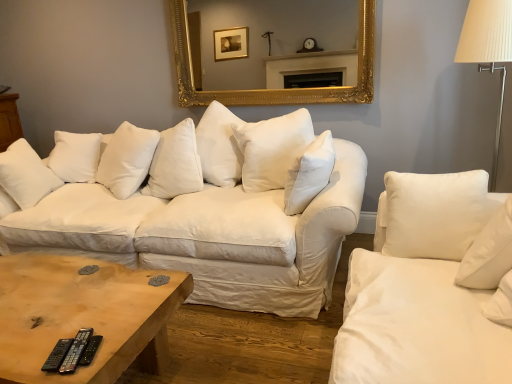
Question: Considering the relative positions of gold ornate mirror at upper center and white soft pillow at center, which is the second pillow from front to back, in the image provided, is gold ornate mirror at upper center behind white soft pillow at center, which is the second pillow from front to back,?

Choices:
 (A) yes
 (B) no

Answer: (A)

Question: Is white soft pillow at center, positioned as the 2th pillow in right-to-left order, located within gold ornate mirror at upper center?

Choices:
 (A) no
 (B) yes

Answer: (A)

Question: Is gold ornate mirror at upper center in contact with white soft pillow at center, which appears as the 1th pillow when viewed from the back?

Choices:
 (A) yes
 (B) no

Answer: (B)

Question: Is gold ornate mirror at upper center taller than white soft pillow at center, which is the second pillow from front to back?

Choices:
 (A) no
 (B) yes

Answer: (B)

Question: From a real-world perspective, does gold ornate mirror at upper center stand above white soft pillow at center, the 1th pillow positioned from the left?

Choices:
 (A) yes
 (B) no

Answer: (A)

Question: Is gold ornate mirror at upper center outside of white soft pillow at center, which is the second pillow from front to back?

Choices:
 (A) yes
 (B) no

Answer: (A)

Question: From a real-world perspective, is black rubber remote at lower left, the second remote in the right-to-left sequence, located higher than white fabric lampshade at right?

Choices:
 (A) no
 (B) yes

Answer: (A)

Question: Is black rubber remote at lower left, arranged as the first remote when viewed from the left, at the right side of white fabric lampshade at right?

Choices:
 (A) yes
 (B) no

Answer: (B)

Question: Considering the relative sizes of black rubber remote at lower left, the second remote in the right-to-left sequence, and white fabric lampshade at right in the image provided, is black rubber remote at lower left, the second remote in the right-to-left sequence, smaller than white fabric lampshade at right?

Choices:
 (A) yes
 (B) no

Answer: (A)

Question: Is black rubber remote at lower left, the second remote in the right-to-left sequence, positioned in front of white fabric lampshade at right?

Choices:
 (A) no
 (B) yes

Answer: (B)

Question: From a real-world perspective, is black rubber remote at lower left, arranged as the first remote when viewed from the left, below white fabric lampshade at right?

Choices:
 (A) no
 (B) yes

Answer: (B)

Question: Is black rubber remote at lower left, arranged as the first remote when viewed from the left, further to camera compared to white fabric lampshade at right?

Choices:
 (A) yes
 (B) no

Answer: (B)

Question: Is the depth of black rubber remote at lower left, the second remote in the right-to-left sequence, less than that of black plastic remote at lower left, which ranks as the 2th remote in left-to-right order?

Choices:
 (A) yes
 (B) no

Answer: (A)